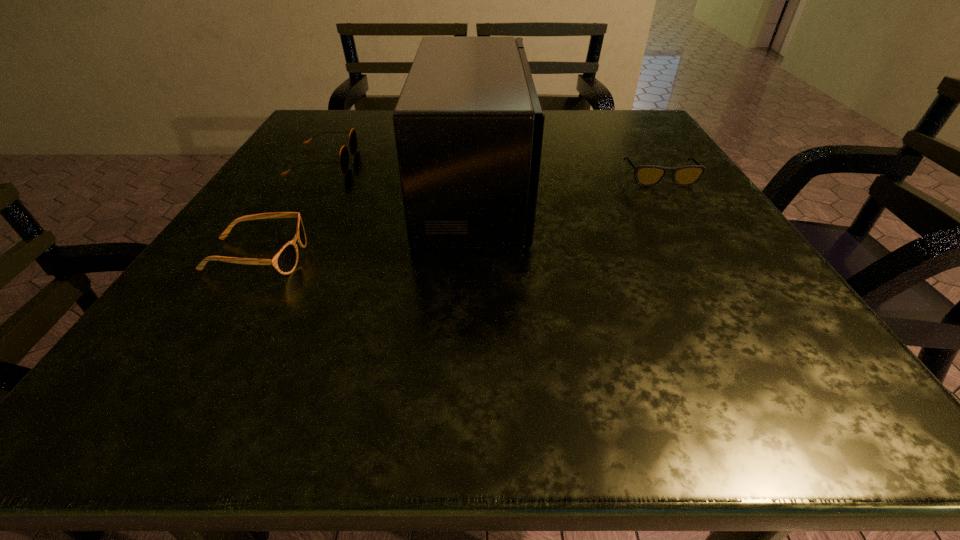
Point out which object is positioned as the third nearest to the tallest object. Please provide its 2D coordinates. Your answer should be formatted as a tuple, i.e. [(x, y)], where the tuple contains the x and y coordinates of a point satisfying the conditions above.

[(645, 175)]

Locate an element on the screen. This screenshot has width=960, height=540. the third closest object relative to the rightmost object is located at coordinates (285, 261).

In order to click on the closest sunglasses relative to the second object from right to left in this screenshot , I will do `click(353, 144)`.

Select which sunglasses is the closest to the nearest sunglasses. Please provide its 2D coordinates. Your answer should be formatted as a tuple, i.e. [(x, y)], where the tuple contains the x and y coordinates of a point satisfying the conditions above.

[(353, 144)]

At what (x,y) coordinates should I click in order to perform the action: click on vacant space that satisfies the following two spatial constraints: 1. on the front-facing side of the rightmost sunglasses; 2. on the front-facing side of the third object from left to right. Please return your answer as a coordinate pair (x, y). The height and width of the screenshot is (540, 960). Looking at the image, I should click on (666, 188).

Locate an element on the screen. Image resolution: width=960 pixels, height=540 pixels. vacant space that satisfies the following two spatial constraints: 1. on the front-facing side of the rightmost sunglasses; 2. on the front-facing side of the second object from right to left is located at coordinates (666, 188).

Identify the location of vacant point that satisfies the following two spatial constraints: 1. on the front-facing side of the rightmost object; 2. on the front-facing side of the nearest sunglasses. This screenshot has width=960, height=540. (709, 257).

The height and width of the screenshot is (540, 960). Find the location of `vacant space that satisfies the following two spatial constraints: 1. on the front-facing side of the rightmost sunglasses; 2. on the front-facing side of the nearest sunglasses`. vacant space that satisfies the following two spatial constraints: 1. on the front-facing side of the rightmost sunglasses; 2. on the front-facing side of the nearest sunglasses is located at coordinates (709, 257).